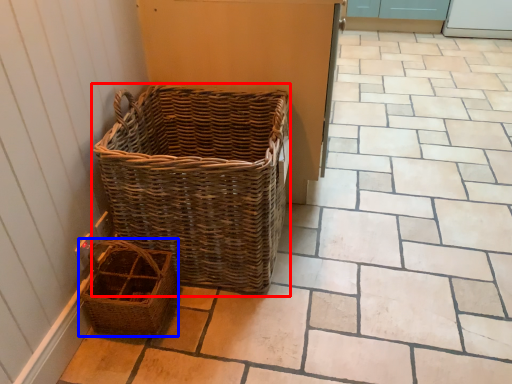
Question: Which of the following is the farthest to the observer, picnic basket (highlighted by a red box) or picnic basket (highlighted by a blue box)?

Choices:
 (A) picnic basket
 (B) picnic basket

Answer: (B)